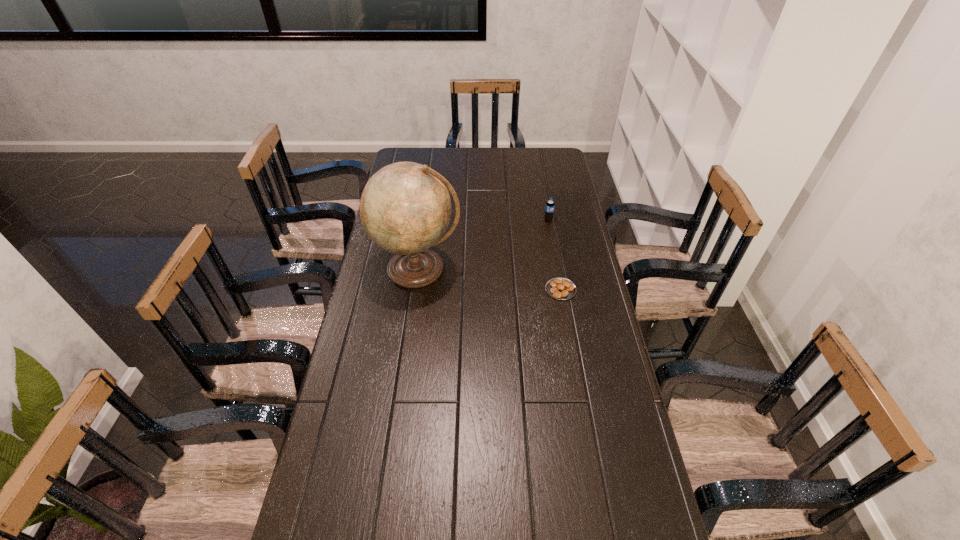
Find the location of a particular element. Image resolution: width=960 pixels, height=540 pixels. vacant space that satisfies the following two spatial constraints: 1. on the front-facing side of the tallest object; 2. on the left side of the shortest object is located at coordinates [x=416, y=289].